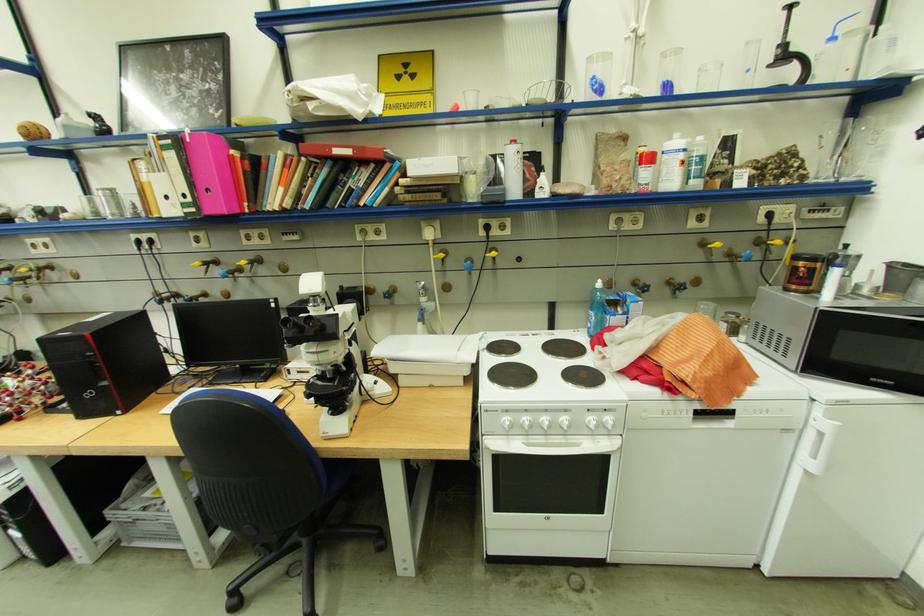
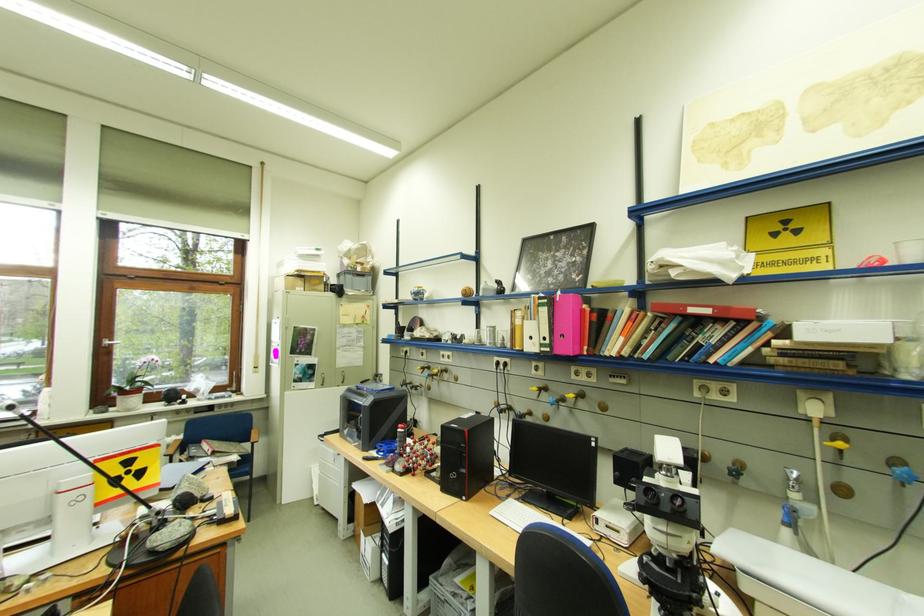
In the second image, find the point that corresponds to (349,391) in the first image.

(698, 594)